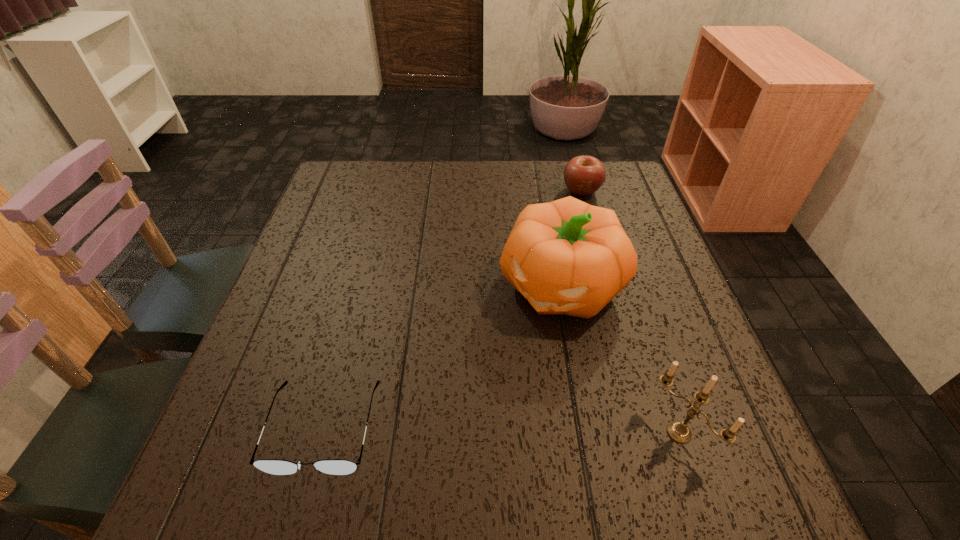
Where is `unoccupied area between the apple and the third shortest object`? Image resolution: width=960 pixels, height=540 pixels. unoccupied area between the apple and the third shortest object is located at coordinates (630, 312).

Where is `unoccupied area between the leftmost object and the pumpkin`? unoccupied area between the leftmost object and the pumpkin is located at coordinates (442, 355).

At what (x,y) coordinates should I click in order to perform the action: click on unoccupied position between the second farthest object and the third shortest object. Please return your answer as a coordinate pair (x, y). Image resolution: width=960 pixels, height=540 pixels. Looking at the image, I should click on (619, 358).

Where is `free area in between the second tallest object and the shortest object`? Image resolution: width=960 pixels, height=540 pixels. free area in between the second tallest object and the shortest object is located at coordinates point(501,430).

The height and width of the screenshot is (540, 960). Identify the location of vacant space that's between the second shortest object and the third shortest object. (630, 312).

Where is `free space that is in between the candle and the third nearest object`? This screenshot has height=540, width=960. free space that is in between the candle and the third nearest object is located at coordinates pos(619,358).

Identify which object is the second nearest to the shortest object. Please provide its 2D coordinates. Your answer should be formatted as a tuple, i.e. [(x, y)], where the tuple contains the x and y coordinates of a point satisfying the conditions above.

[(678, 431)]

Find the location of `the closest object to the apple`. the closest object to the apple is located at coordinates (568, 257).

At what (x,y) coordinates should I click in order to perform the action: click on free spot that satisfies the following two spatial constraints: 1. on the back side of the second farthest object; 2. on the right side of the apple. Please return your answer as a coordinate pair (x, y). Looking at the image, I should click on (543, 191).

Identify the location of free space that satisfies the following two spatial constraints: 1. on the lenses of the candle; 2. on the left side of the shortest object. (323, 433).